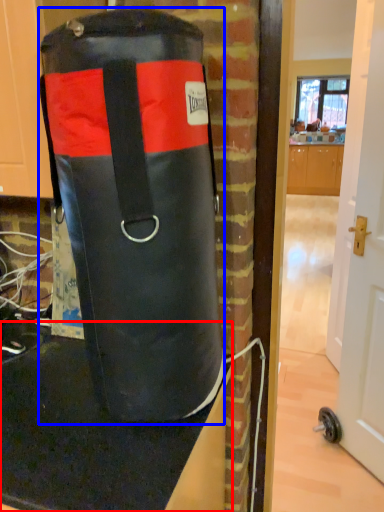
Question: Which point is further to the camera, table top (highlighted by a red box) or punching bag (highlighted by a blue box)?

Choices:
 (A) table top
 (B) punching bag

Answer: (A)